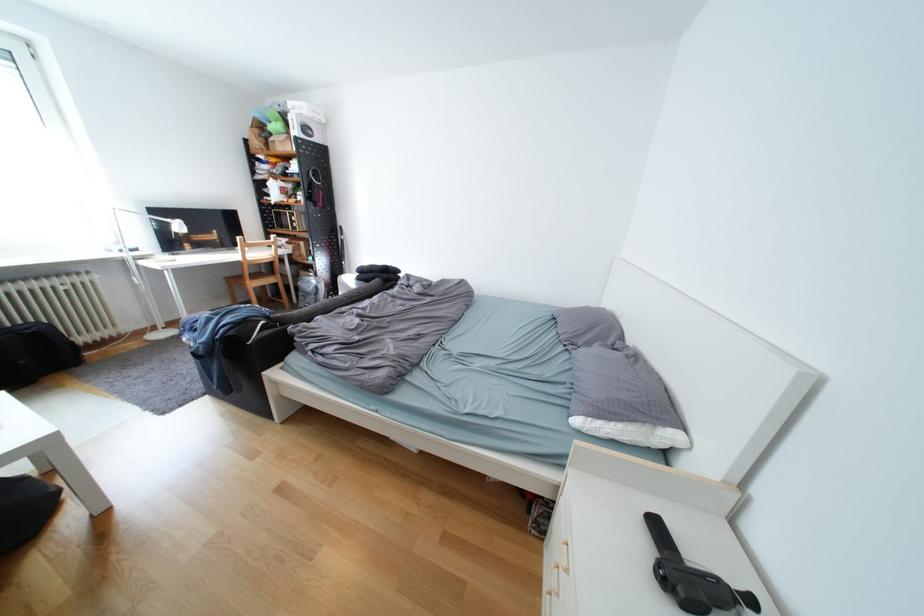
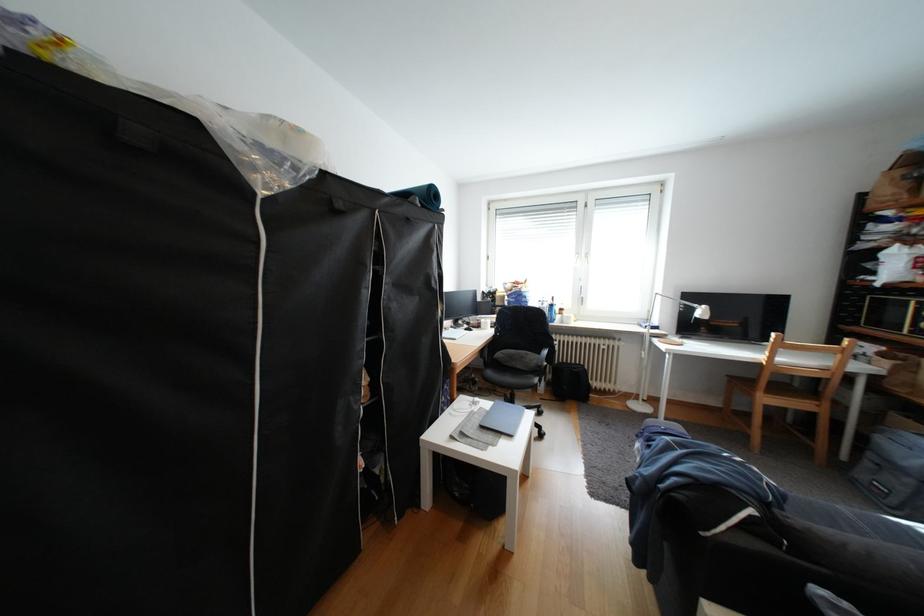
Question: How did the camera likely rotate?

Choices:
 (A) Left
 (B) Right
 (C) Up
 (D) Down

Answer: (A)